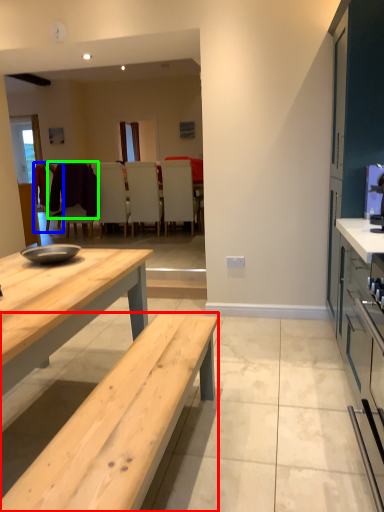
Question: Which object is the closest to the table (highlighted by a red box)? Choose among these: chair (highlighted by a blue box) or laundry (highlighted by a green box).

Choices:
 (A) chair
 (B) laundry

Answer: (A)